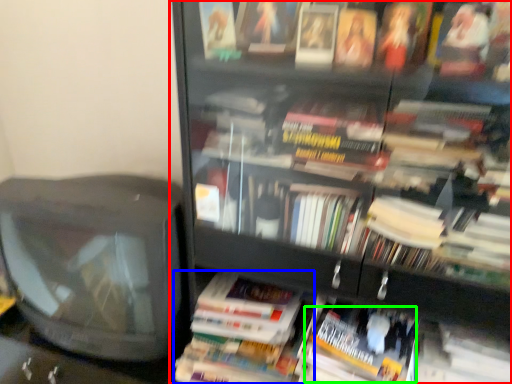
Question: Which is nearer to the bookcase (highlighted by a red box)? paperback book (highlighted by a blue box) or paperback book (highlighted by a green box).

Choices:
 (A) paperback book
 (B) paperback book

Answer: (B)